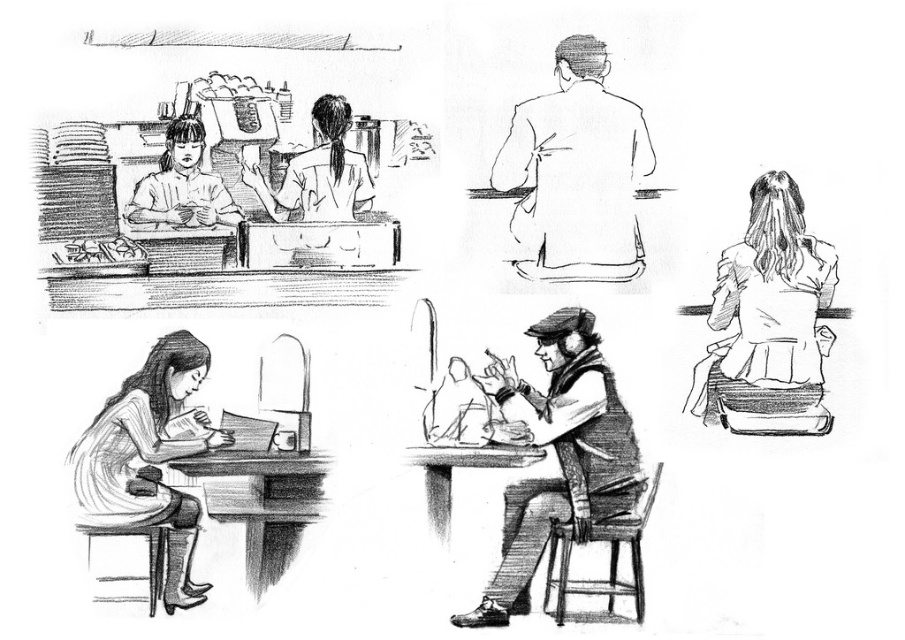
Who is shorter, smooth white blouse at lower left or matte white blouse at upper left?

matte white blouse at upper left

Is point (99, 488) positioned in front of point (172, 166)?

Yes, it is.

The image size is (905, 640). In order to click on smooth white blouse at lower left in this screenshot , I will do `click(148, 460)`.

This screenshot has height=640, width=905. What do you see at coordinates (576, 172) in the screenshot? I see `smooth beige jacket at upper center` at bounding box center [576, 172].

Who is more forward, [618,253] or [154,358]?

Point [154,358]

Find the location of `smooth beige jacket at upper center`. smooth beige jacket at upper center is located at coordinates (576, 172).

Which of these two, white matte jacket at upper right or smooth white blouse at lower left, stands taller?

With more height is smooth white blouse at lower left.

Which is more to the left, white matte jacket at upper right or smooth white blouse at lower left?

smooth white blouse at lower left is more to the left.

This screenshot has height=640, width=905. I want to click on white matte jacket at upper right, so click(x=768, y=321).